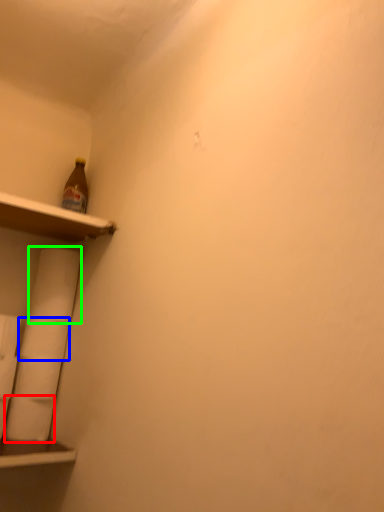
Question: Which object is the farthest from toilet paper (highlighted by a red box)? Choose among these: toilet paper (highlighted by a blue box) or toilet paper (highlighted by a green box).

Choices:
 (A) toilet paper
 (B) toilet paper

Answer: (B)